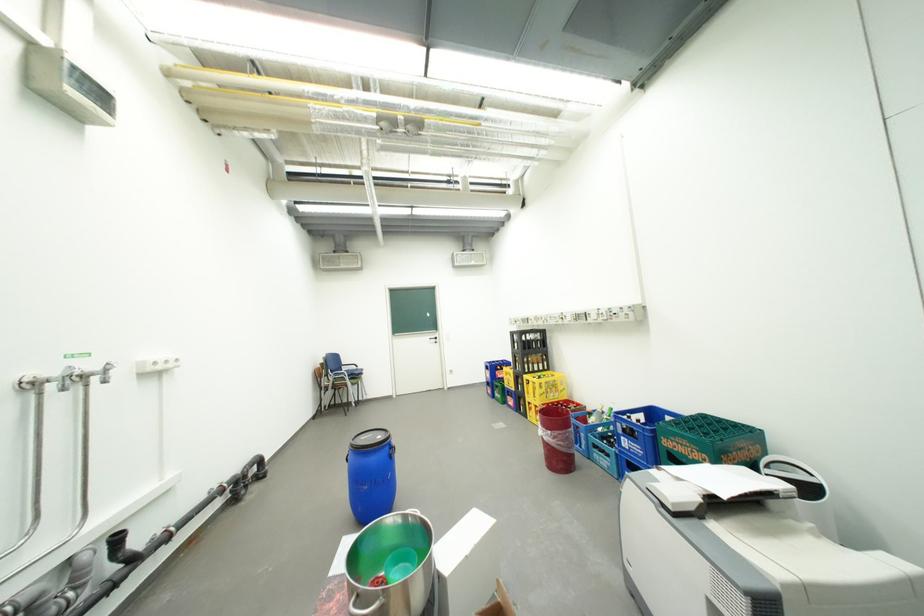
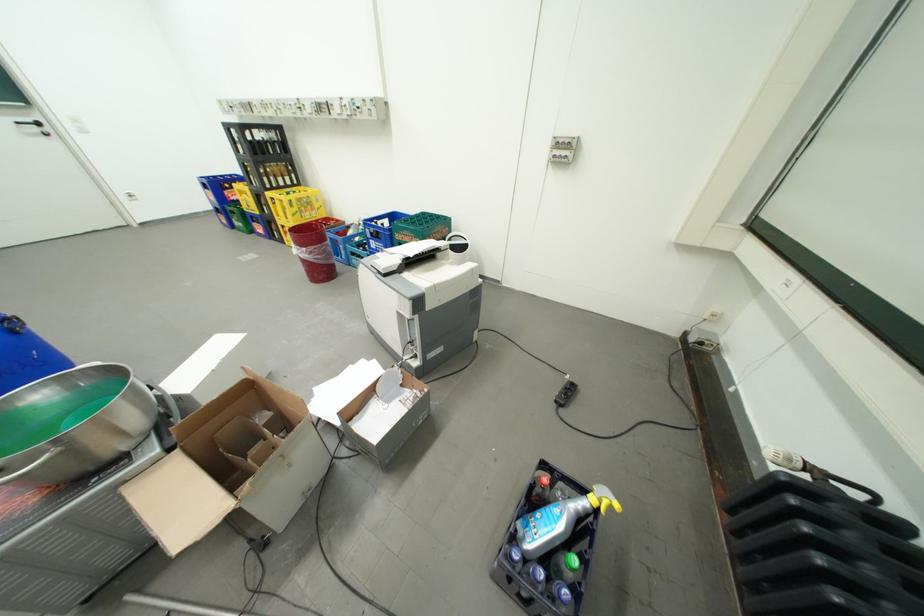
In the second image, find the point that corresponds to pixel 633 439 in the first image.

(381, 241)